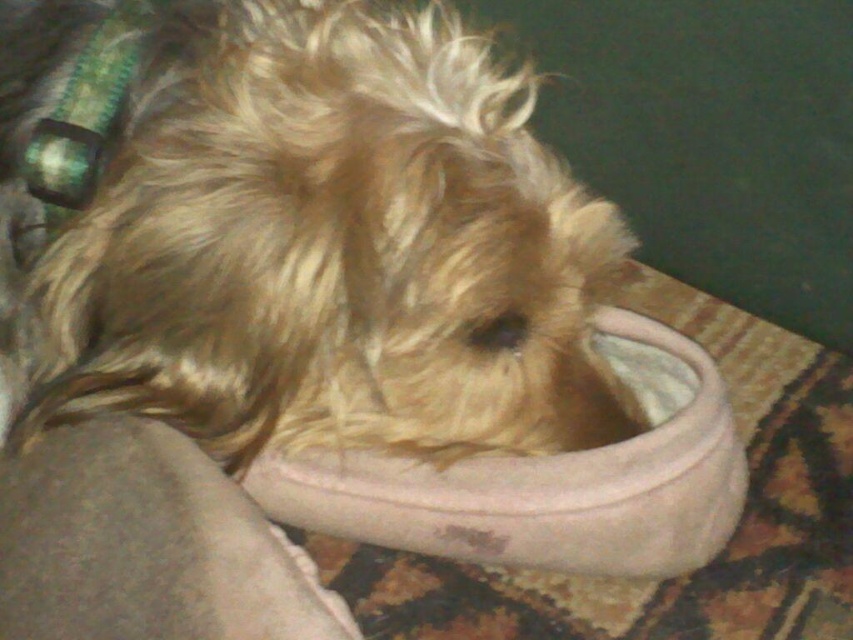
Question: Which point is closer to the camera taking this photo?

Choices:
 (A) (221, 228)
 (B) (670, 573)

Answer: (A)

Question: Observing the image, what is the correct spatial positioning of fuzzy brown dog at center in reference to beige suede slipper at center?

Choices:
 (A) left
 (B) right

Answer: (A)

Question: Can you confirm if fuzzy brown dog at center is bigger than beige suede slipper at center?

Choices:
 (A) no
 (B) yes

Answer: (B)

Question: Can you confirm if fuzzy brown dog at center is positioned to the right of beige suede slipper at center?

Choices:
 (A) no
 (B) yes

Answer: (A)